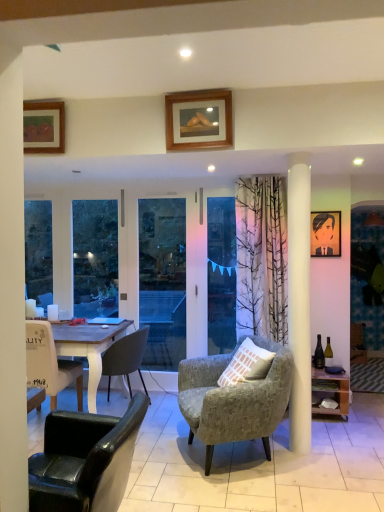
Describe the element at coordinates (221, 274) in the screenshot. This screenshot has height=512, width=384. I see `transparent plastic window screen at center` at that location.

Find the location of `textured gray armchair at center, which ranks as the 2th chair in back-to-front order`. textured gray armchair at center, which ranks as the 2th chair in back-to-front order is located at coordinates (234, 399).

Image resolution: width=384 pixels, height=512 pixels. Describe the element at coordinates (52, 312) in the screenshot. I see `white matte coffee cup at left` at that location.

The image size is (384, 512). Identify the location of wooden-framed artwork at upper left, arranged as the fourth picture frame when ordered from the bottom. (44, 127).

The height and width of the screenshot is (512, 384). I want to click on transparent plastic window screen at center, so click(221, 274).

How different are the orientations of wooden shelf at right and textured gray armchair at center, which ranks as the 2th chair in back-to-front order, in degrees?

The angular difference between wooden shelf at right and textured gray armchair at center, which ranks as the 2th chair in back-to-front order, is 67 degrees.

Does wooden shelf at right turn towards textured gray armchair at center, which ranks as the 2th chair in back-to-front order?

No.

Between wooden shelf at right and textured gray armchair at center, which ranks as the 2th chair in front-to-back order, which one appears on the right side from the viewer's perspective?

From the viewer's perspective, wooden shelf at right appears more on the right side.

Is point (318, 404) positioned in front of point (178, 397)?

No, it is not.

Considering the sizes of matte black portrait at upper right, which is counted as the 2th picture frame, starting from the right, and wooden-framed artwork at upper left, marked as the 1th picture frame in a left-to-right arrangement, in the image, is matte black portrait at upper right, which is counted as the 2th picture frame, starting from the right, taller or shorter than wooden-framed artwork at upper left, marked as the 1th picture frame in a left-to-right arrangement,?

matte black portrait at upper right, which is counted as the 2th picture frame, starting from the right, is taller than wooden-framed artwork at upper left, marked as the 1th picture frame in a left-to-right arrangement.

Is point (313, 247) positioned in front of point (51, 114)?

That is False.

Is wooden-framed artwork at upper left, the third picture frame when ordered from back to front, inside matte black portrait at upper right, placed as the 3th picture frame when sorted from front to back?

No.

Is textured gray armchair at center, which ranks as the 2th chair in back-to-front order, closer to the viewer compared to transparent plastic window screen at center?

Yes, it is in front of transparent plastic window screen at center.

From the image's perspective, between textured gray armchair at center, which ranks as the 2th chair in front-to-back order, and transparent plastic window screen at center, who is located below?

From the image's view, textured gray armchair at center, which ranks as the 2th chair in front-to-back order, is below.

Considering the positions of objects white matte coffee cup at left and dark gray fabric chair at lower left, placed as the 3th chair when sorted from front to back, in the image provided, who is more to the right, white matte coffee cup at left or dark gray fabric chair at lower left, placed as the 3th chair when sorted from front to back,?

dark gray fabric chair at lower left, placed as the 3th chair when sorted from front to back, is more to the right.

Which of these two, white matte coffee cup at left or dark gray fabric chair at lower left, placed as the 3th chair when sorted from front to back, stands taller?

dark gray fabric chair at lower left, placed as the 3th chair when sorted from front to back, is taller.

In the scene shown: Is white matte coffee cup at left facing away from dark gray fabric chair at lower left, placed as the 3th chair when sorted from front to back?

white matte coffee cup at left does not have its back to dark gray fabric chair at lower left, placed as the 3th chair when sorted from front to back.

Is wooden picture frame at right, placed as the first picture frame when sorted from back to front, wider than wooden-framed artwork at upper left, the third picture frame when ordered from back to front?

In fact, wooden picture frame at right, placed as the first picture frame when sorted from back to front, might be narrower than wooden-framed artwork at upper left, the third picture frame when ordered from back to front.

Which object is more forward, wooden picture frame at right, acting as the fourth picture frame starting from the front, or wooden-framed artwork at upper left, acting as the fourth picture frame starting from the right?

wooden-framed artwork at upper left, acting as the fourth picture frame starting from the right.

From the image's perspective, between wooden picture frame at right, the 4th picture frame viewed from the top, and wooden-framed artwork at upper left, acting as the fourth picture frame starting from the right, who is located below?

wooden picture frame at right, the 4th picture frame viewed from the top.

Locate an element on the screen. picture frame that is the 3rd one when counting rightward from the wooden-framed artwork at upper left, arranged as the fourth picture frame when ordered from the bottom is located at coordinates (x=368, y=273).

Between matte black portrait at upper right, positioned as the 2th picture frame in bottom-to-top order, and white matte coffee cup at left, which one appears on the left side from the viewer's perspective?

From the viewer's perspective, white matte coffee cup at left appears more on the left side.

Considering the positions of points (328, 213) and (53, 315), is point (328, 213) farther from camera compared to point (53, 315)?

Yes, point (328, 213) is farther from viewer.

Considering the sizes of matte black portrait at upper right, placed as the 3th picture frame when sorted from front to back, and white matte coffee cup at left in the image, is matte black portrait at upper right, placed as the 3th picture frame when sorted from front to back, taller or shorter than white matte coffee cup at left?

In the image, matte black portrait at upper right, placed as the 3th picture frame when sorted from front to back, appears to be taller than white matte coffee cup at left.

Is matte black portrait at upper right, positioned as the 3th picture frame in left-to-right order, in front of or behind white matte coffee cup at left in the image?

Visually, matte black portrait at upper right, positioned as the 3th picture frame in left-to-right order, is located in front of white matte coffee cup at left.

Is transparent plastic window screen at center positioned with its back to white matte coffee cup at left?

No, transparent plastic window screen at center is not facing the opposite direction of white matte coffee cup at left.

Is transparent plastic window screen at center not within white matte coffee cup at left?

Yes, transparent plastic window screen at center is not within white matte coffee cup at left.

How distant is transparent plastic window screen at center from white matte coffee cup at left?

5.85 feet.

Is transparent plastic window screen at center beside white matte coffee cup at left?

transparent plastic window screen at center and white matte coffee cup at left are clearly separated.

Identify the location of the 1st chair counting from the left of the wooden shelf at right. (234, 399).

Locate an element on the screen. The width and height of the screenshot is (384, 512). the 2nd picture frame below the wooden-framed artwork at upper left, the first picture frame from the top (from a real-world perspective) is located at coordinates (325, 234).

When comparing their distances from wooden shelf at right, does matte black portrait at upper right, the third picture frame in the top-to-bottom sequence, or leather-like black chair at lower left, the first chair positioned from the front, seem closer?

matte black portrait at upper right, the third picture frame in the top-to-bottom sequence, is positioned closer to the anchor wooden shelf at right.

Estimate the real-world distances between objects in this image. Which object is further from white matte coffee cup at left, textured gray armchair at center, which ranks as the 2th chair in back-to-front order, or transparent plastic window screen at center?

textured gray armchair at center, which ranks as the 2th chair in back-to-front order, is further to white matte coffee cup at left.

From the image, which object appears to be nearer to wooden-framed artwork at upper left, arranged as the fourth picture frame when ordered from the bottom, wooden shelf at right or leather-like black chair at lower left, positioned as the third chair in back-to-front order?

leather-like black chair at lower left, positioned as the third chair in back-to-front order, lies closer to wooden-framed artwork at upper left, arranged as the fourth picture frame when ordered from the bottom, than the other object.

Estimate the real-world distances between objects in this image. Which object is further from wooden-framed artwork at upper left, which is the 2th picture frame from front to back, textured gray armchair at center, which ranks as the 2th chair in front-to-back order, or wooden picture frame at upper center, which appears as the 2th picture frame when viewed from the left?

Based on the image, textured gray armchair at center, which ranks as the 2th chair in front-to-back order, appears to be further to wooden-framed artwork at upper left, which is the 2th picture frame from front to back.

When comparing their distances from textured gray armchair at center, which ranks as the 2th chair in back-to-front order, does wooden shelf at right or wooden picture frame at upper center, which is counted as the 2th picture frame, starting from the top, seem further?

wooden picture frame at upper center, which is counted as the 2th picture frame, starting from the top, is further to textured gray armchair at center, which ranks as the 2th chair in back-to-front order.

When comparing their distances from wooden-framed artwork at upper left, the first picture frame from the top, does wooden picture frame at right, arranged as the fourth picture frame when viewed from the left, or wooden picture frame at upper center, which is counted as the 2th picture frame, starting from the top, seem closer?

wooden picture frame at upper center, which is counted as the 2th picture frame, starting from the top.

Considering their positions, is matte black portrait at upper right, the second picture frame positioned from the back, positioned further to wooden-framed artwork at upper left, the first picture frame from the top, than dark gray fabric chair at lower left, positioned as the first chair in back-to-front order?

The object further to wooden-framed artwork at upper left, the first picture frame from the top, is matte black portrait at upper right, the second picture frame positioned from the back.

From the image, which object appears to be farther from wooden-framed artwork at upper left, marked as the 1th picture frame in a left-to-right arrangement, white matte coffee cup at left or transparent plastic window screen at center?

transparent plastic window screen at center is positioned further to the anchor wooden-framed artwork at upper left, marked as the 1th picture frame in a left-to-right arrangement.

You are a GUI agent. You are given a task and a screenshot of the screen. Output one action in this format:
    pyautogui.click(x=<x>, y=<y>)
    Task: Click on the picture frame between matte black portrait at upper right, placed as the 3th picture frame when sorted from front to back, and wooden shelf at right vertically
    
    Given the screenshot: What is the action you would take?
    pyautogui.click(x=368, y=273)

I want to click on chair between textured gray armchair at center, which ranks as the 2th chair in front-to-back order, and transparent plastic window screen at center, along the z-axis, so click(125, 358).

What are the coordinates of `window screen between matte black portrait at upper right, the third picture frame in the top-to-bottom sequence, and wooden shelf at right vertically` in the screenshot? It's located at (221, 274).

Find the location of a particular element. The width and height of the screenshot is (384, 512). shelf between dark gray fabric chair at lower left, placed as the 3th chair when sorted from front to back, and wooden picture frame at right, the 4th picture frame viewed from the top is located at coordinates (330, 392).